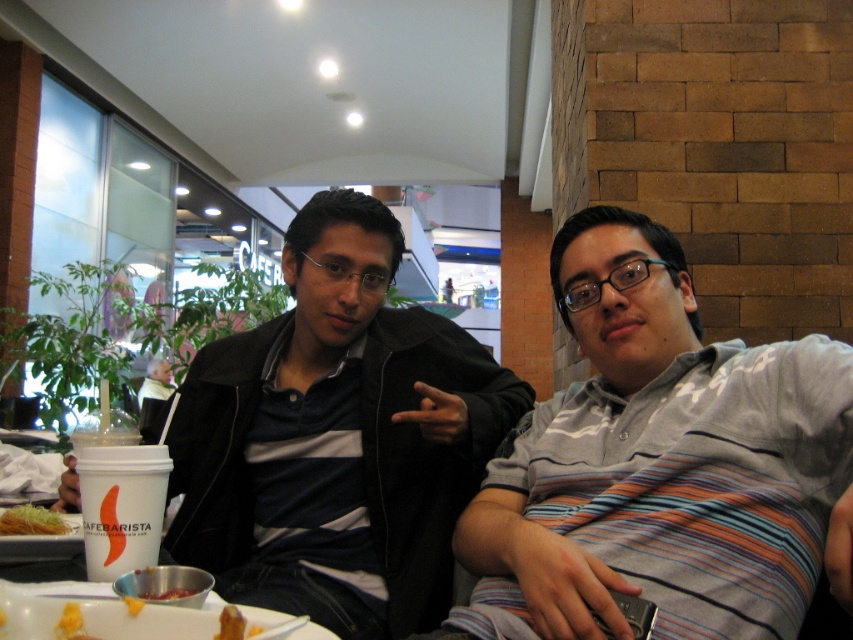
You are a food delivery person standing at the entrance of the cafe. You need to pick up the golden crispy noodles at lower left for delivery. Can you reach it without moving the table?

The golden crispy noodles at lower left is 1.06 meters away from viewer. Since you are standing at the entrance, the distance might be too far to reach without moving the table.

You are a photographer taking a picture of the scene described. You notice the gray striped shirt at center and the golden crispy noodles at lower left. Based on their positions, which object is closer to the camera?

The gray striped shirt at center is located above the golden crispy noodles at lower left, so it is closer to the camera.

In the scene shown: You are standing in front of the image and want to locate the matte black jacket at center. Which quadrant of the image does it occupy?

The matte black jacket at center is located at point coordinates 0.684 on the x axis and 0.396 on the y axis, so it is in the bottom right quadrant of the image.